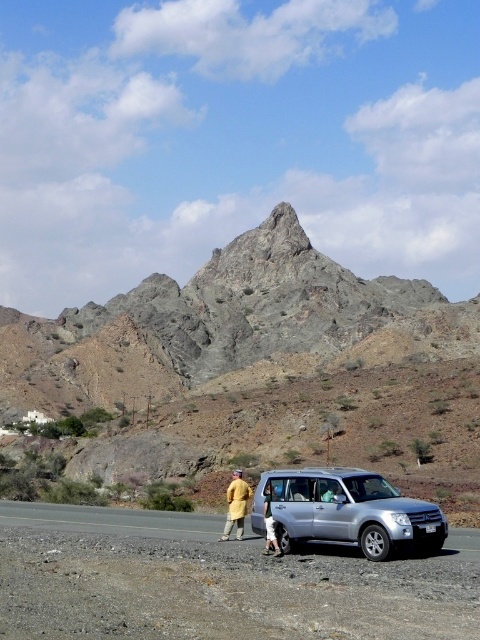
You are a hiker planning to take a photo of both the gray rocky mountain at upper center and the light brown leather jacket at lower center in the scene. Given that your camera can only focus on objects within 600 feet of each other, will you be able to capture both in a single shot?

The gray rocky mountain at upper center and the light brown leather jacket at lower center are 622.53 feet apart from each other, which exceeds the camera focus range of 600 feet. Therefore, you cannot capture both in a single shot.

You are a photographer standing on the roadside and want to take a photo of two points marked in the image. The first point is at coordinates point (237, 250) and the second point is at point (295, 492). Which point will appear closer to the bottom of the photo?

Point (295, 492) will appear closer to the bottom of the photo because it is further away from the camera compared to point (237, 250), which is closer to the camera.

You are a photographer positioned at the camera location. You want to capture a photo that includes both the silver SUV and the person in the yellow outfit. The silver SUV is located at point (284, 496) and the person in yellow is at point (228, 502). Which of these two subjects will appear larger in your photo?

Point (284, 496) is closer to the camera than point (228, 502), so the silver SUV at point (284, 496) will appear larger in the photo than the person in yellow outfit at point (228, 502).